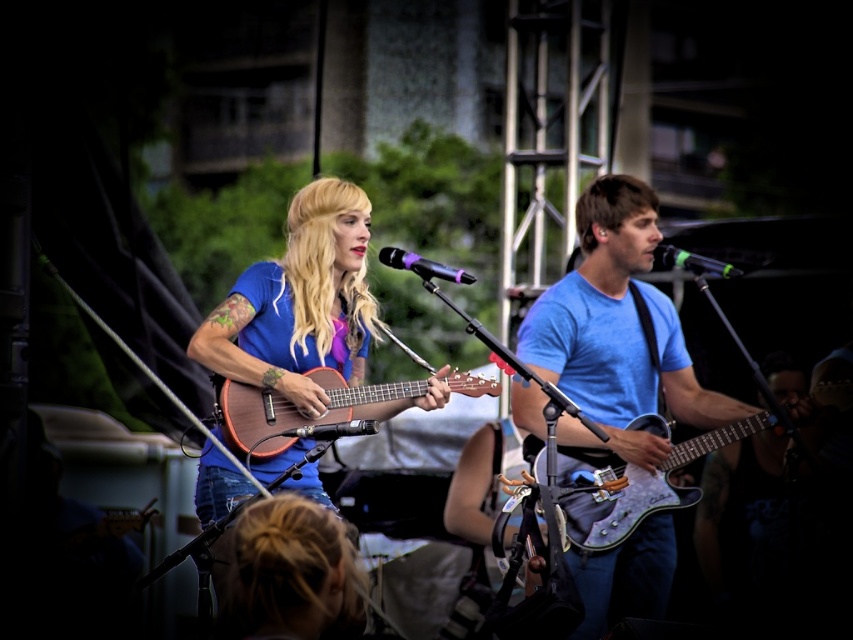
Question: Which is farther from the purple matte microphone at center?

Choices:
 (A) white glossy electric guitar at center
 (B) matte blue shirt at center
 (C) black metallic microphone at center
 (D) wooden acoustic guitar at center

Answer: (C)

Question: Which point is farther to the camera?

Choices:
 (A) white glossy electric guitar at center
 (B) matte blue shirt at center
 (C) matte blue guitar at right
 (D) wooden acoustic guitar at center

Answer: (C)

Question: Is matte blue guitar at right in front of matte blue shirt at center?

Choices:
 (A) no
 (B) yes

Answer: (A)

Question: Is white glossy electric guitar at center positioned behind purple matte microphone at center?

Choices:
 (A) yes
 (B) no

Answer: (A)

Question: Where is white glossy electric guitar at center located in relation to metallic silver microphone at center in the image?

Choices:
 (A) left
 (B) right

Answer: (B)

Question: Among these objects, which one is nearest to the camera?

Choices:
 (A) black metallic microphone at center
 (B) metallic silver microphone at center

Answer: (B)